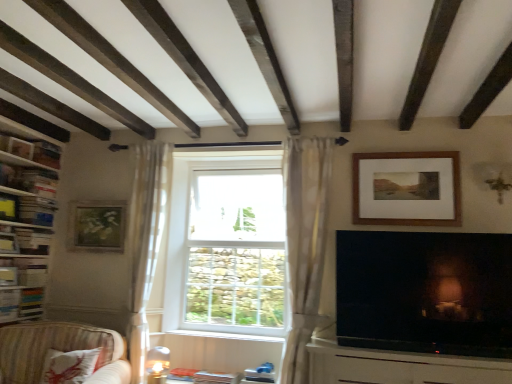
Question: From the image's perspective, is wooden bookshelf at left, which is the 2th shelf from top to bottom, located above sheer white curtain at center, positioned as the 2th curtain in left-to-right order?

Choices:
 (A) no
 (B) yes

Answer: (B)

Question: Is wooden bookshelf at left, which is the 2th shelf from top to bottom, next to sheer white curtain at center, which is the 1th curtain in right-to-left order?

Choices:
 (A) no
 (B) yes

Answer: (A)

Question: Is wooden bookshelf at left, placed as the 1th shelf when sorted from bottom to top, looking in the opposite direction of sheer white curtain at center, which is the 1th curtain in right-to-left order?

Choices:
 (A) no
 (B) yes

Answer: (A)

Question: Can you confirm if wooden bookshelf at left, placed as the 1th shelf when sorted from bottom to top, is thinner than sheer white curtain at center, positioned as the 2th curtain in left-to-right order?

Choices:
 (A) no
 (B) yes

Answer: (B)

Question: Does wooden bookshelf at left, placed as the 1th shelf when sorted from bottom to top, have a greater height compared to sheer white curtain at center, which is the 1th curtain in right-to-left order?

Choices:
 (A) no
 (B) yes

Answer: (A)

Question: Based on their positions, is sheer white curtain at center, which is the 1th curtain in right-to-left order, located to the left or right of wooden bookshelf at left, which is the 2th shelf from top to bottom?

Choices:
 (A) right
 (B) left

Answer: (A)

Question: Considering the positions of point (294, 317) and point (18, 228), is point (294, 317) closer or farther from the camera than point (18, 228)?

Choices:
 (A) closer
 (B) farther

Answer: (A)

Question: In terms of width, does sheer white curtain at center, which is the 1th curtain in right-to-left order, look wider or thinner when compared to wooden bookshelf at left, which is the 2th shelf from top to bottom?

Choices:
 (A) thin
 (B) wide

Answer: (B)

Question: In terms of size, does sheer white curtain at center, positioned as the 2th curtain in left-to-right order, appear bigger or smaller than wooden bookshelf at left, placed as the 1th shelf when sorted from bottom to top?

Choices:
 (A) big
 (B) small

Answer: (A)

Question: From a real-world perspective, is matte black television at lower right positioned above or below wooden bookshelf at left, the first shelf from the top?

Choices:
 (A) below
 (B) above

Answer: (A)

Question: In terms of height, does matte black television at lower right look taller or shorter compared to wooden bookshelf at left, the first shelf from the top?

Choices:
 (A) tall
 (B) short

Answer: (B)

Question: Considering the relative positions of matte black television at lower right and wooden bookshelf at left, the first shelf from the top, in the image provided, is matte black television at lower right to the left or to the right of wooden bookshelf at left, the first shelf from the top,?

Choices:
 (A) right
 (B) left

Answer: (A)

Question: Choose the correct answer: Is matte black television at lower right inside wooden bookshelf at left, the first shelf from the top, or outside it?

Choices:
 (A) inside
 (B) outside

Answer: (B)

Question: From a real-world perspective, relative to sheer white curtain at center, positioned as the 2th curtain in left-to-right order, is white glass window at center vertically above or below?

Choices:
 (A) above
 (B) below

Answer: (A)

Question: Considering the positions of white glass window at center and sheer white curtain at center, which is the 1th curtain in right-to-left order, in the image, is white glass window at center taller or shorter than sheer white curtain at center, which is the 1th curtain in right-to-left order,?

Choices:
 (A) tall
 (B) short

Answer: (B)